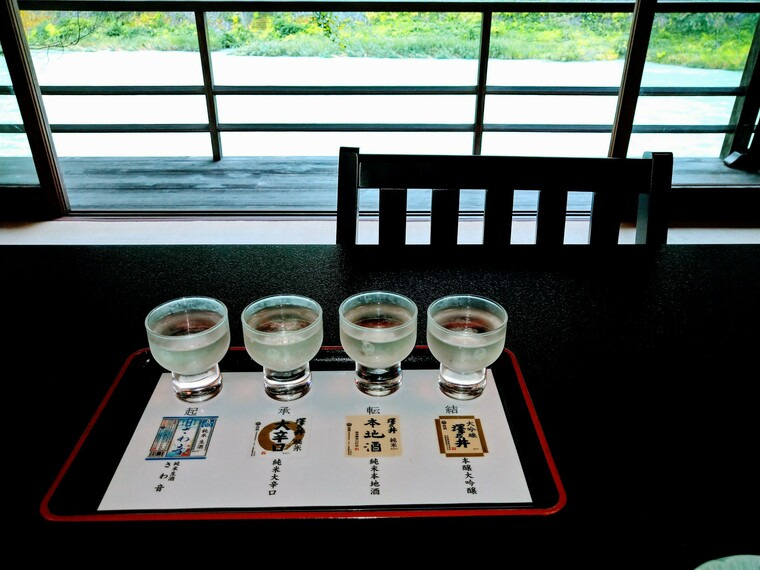
The width and height of the screenshot is (760, 570). What are the coordinates of `table` in the screenshot? It's located at (309, 543).